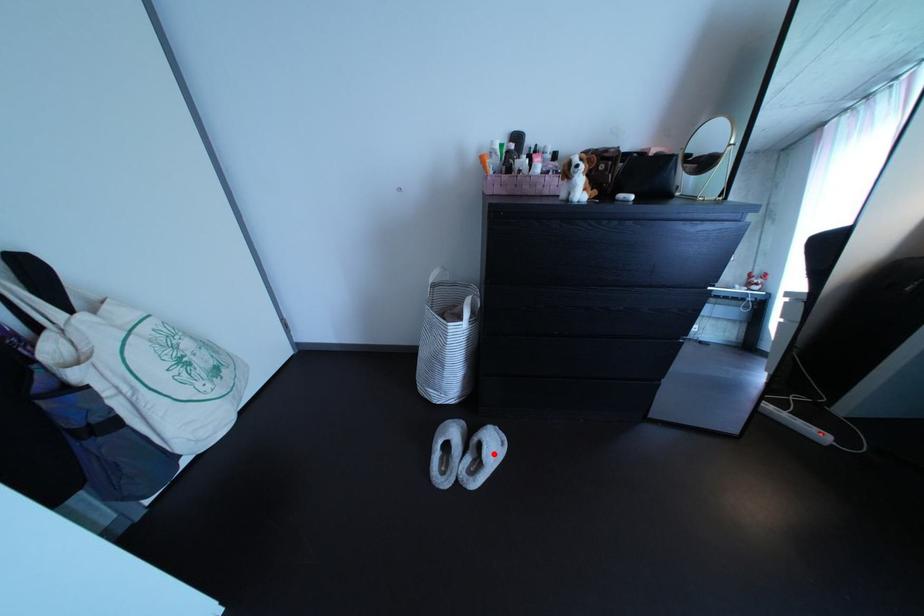
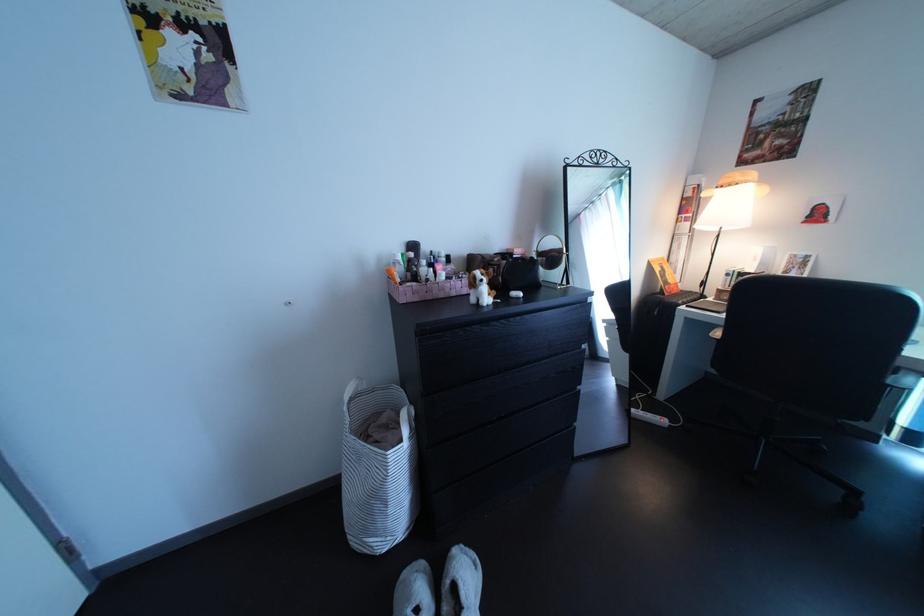
Where in the second image is the point corresponding to the highlighted location from the first image?

(468, 596)